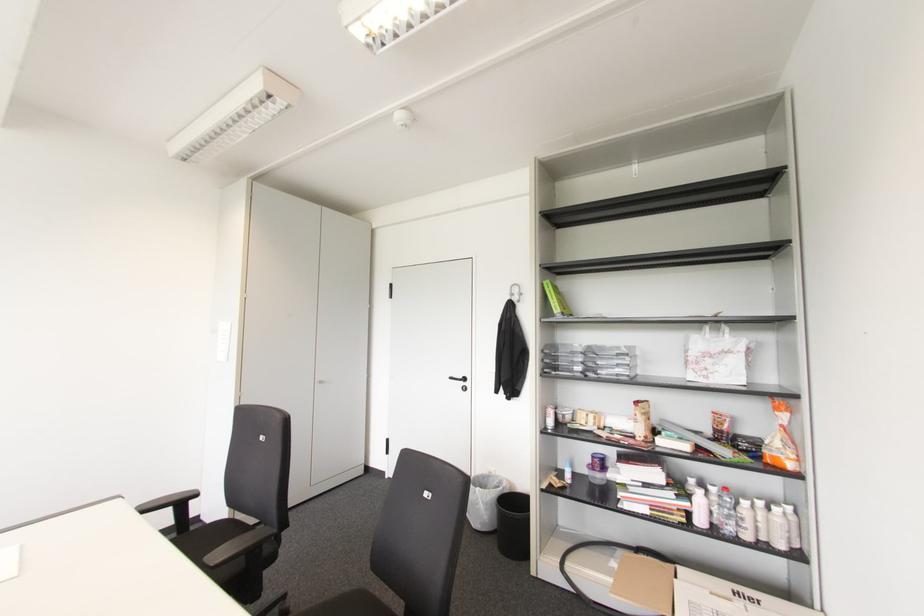
Locate an element on the screen. The image size is (924, 616). white paper bag is located at coordinates (716, 357).